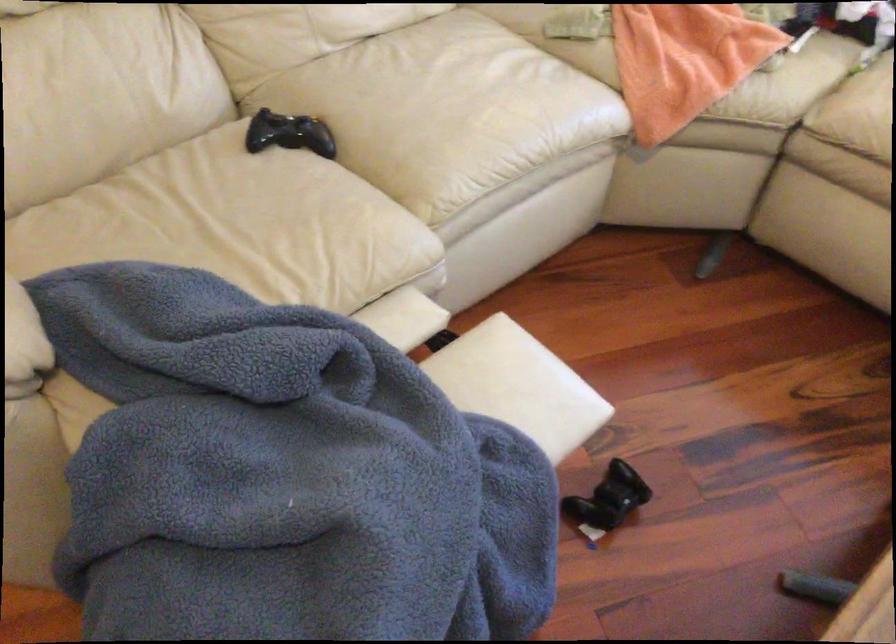
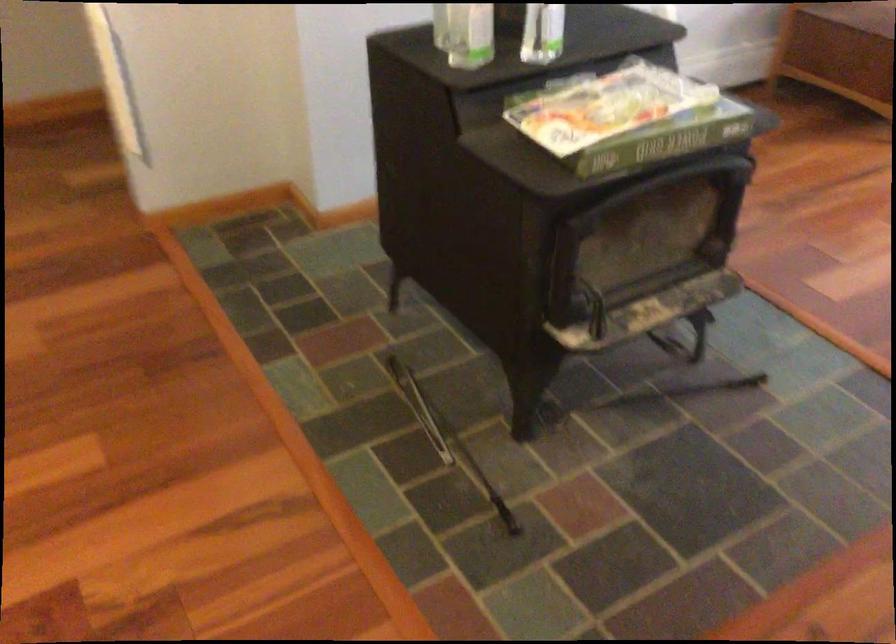
Question: Which direction would the cameraman need to move to produce the second image? Reply with the corresponding letter.

Choices:
 (A) Left
 (B) Right
 (C) Forward
 (D) Backward

Answer: (A)